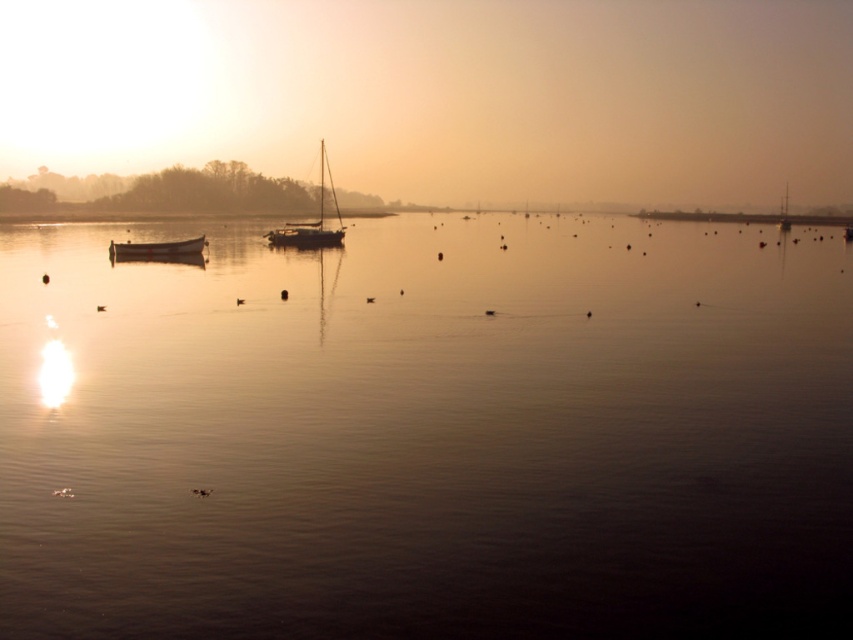
Question: Does smooth water at center lie in front of shiny white sailboat at center?

Choices:
 (A) yes
 (B) no

Answer: (A)

Question: In this image, where is smooth water at center located relative to matte black boat at left?

Choices:
 (A) right
 (B) left

Answer: (A)

Question: Which point is closer to the camera taking this photo?

Choices:
 (A) (270, 438)
 (B) (323, 186)
 (C) (125, 248)

Answer: (A)

Question: Among these points, which one is farthest from the camera?

Choices:
 (A) (306, 237)
 (B) (189, 244)
 (C) (747, 392)

Answer: (A)

Question: Which of these objects is positioned closest to the shiny white sailboat at center?

Choices:
 (A) matte black boat at left
 (B) smooth water at center

Answer: (B)

Question: Is shiny white sailboat at center smaller than matte black boat at left?

Choices:
 (A) no
 (B) yes

Answer: (A)